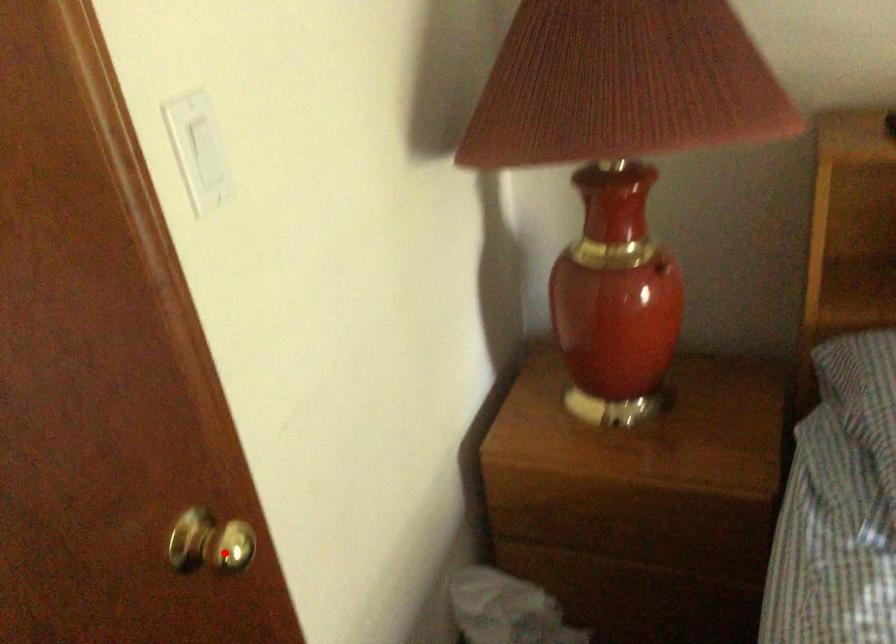
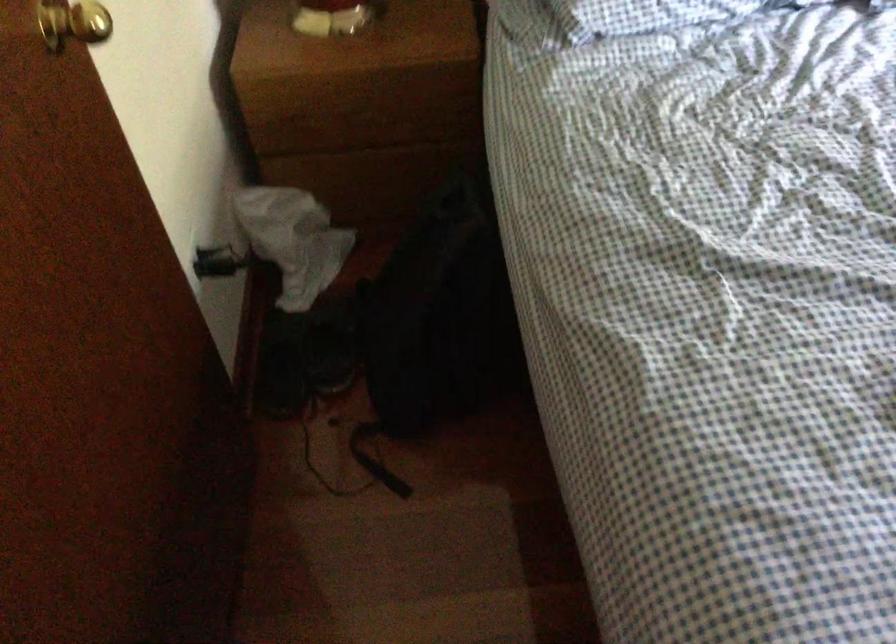
In the second image, find the point that corresponds to the highlighted location in the first image.

(73, 23)